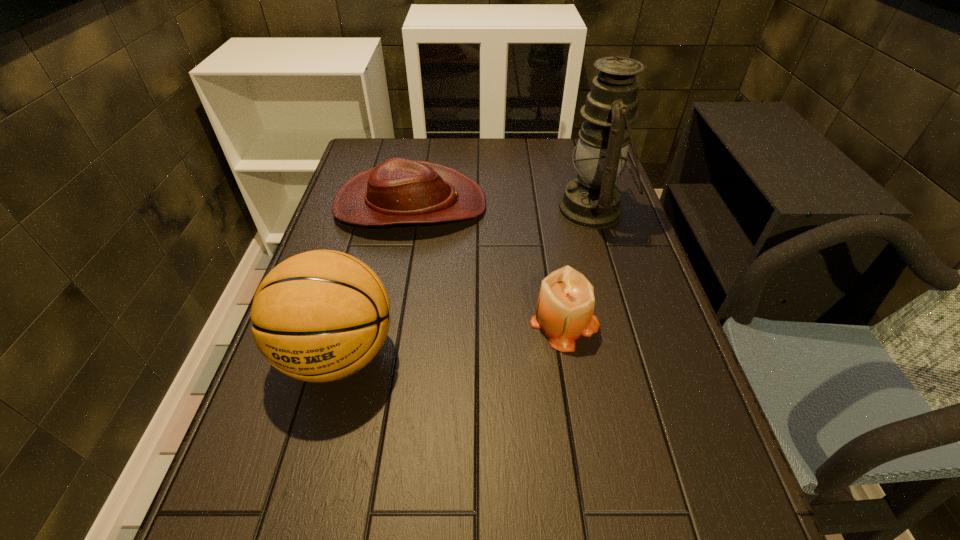
Where is `cowboy hat that is positioned at the left edge`? The height and width of the screenshot is (540, 960). cowboy hat that is positioned at the left edge is located at coordinates (397, 191).

Image resolution: width=960 pixels, height=540 pixels. Find the location of `oil lamp at the right edge`. oil lamp at the right edge is located at coordinates (592, 201).

What are the coordinates of `candle present at the right edge` in the screenshot? It's located at (565, 306).

The image size is (960, 540). What are the coordinates of `object that is at the far left corner` in the screenshot? It's located at (397, 191).

Identify the location of blank space at the far edge. The height and width of the screenshot is (540, 960). (485, 143).

The width and height of the screenshot is (960, 540). I want to click on vacant space at the left edge of the desktop, so click(370, 247).

You are a GUI agent. You are given a task and a screenshot of the screen. Output one action in this format:
    pyautogui.click(x=<x>, y=<y>)
    Task: Click on the free space at the right edge of the desktop
    The width and height of the screenshot is (960, 540).
    Given the screenshot: What is the action you would take?
    pyautogui.click(x=644, y=260)

Locate an element on the screen. free space at the far left corner of the desktop is located at coordinates (358, 147).

This screenshot has height=540, width=960. I want to click on free point between the basketball and the tallest object, so click(x=466, y=282).

You are a GUI agent. You are given a task and a screenshot of the screen. Output one action in this format:
    pyautogui.click(x=<x>, y=<y>)
    Task: Click on the vacant area between the shortest object and the third tallest object
    The width and height of the screenshot is (960, 540).
    Given the screenshot: What is the action you would take?
    pyautogui.click(x=488, y=262)